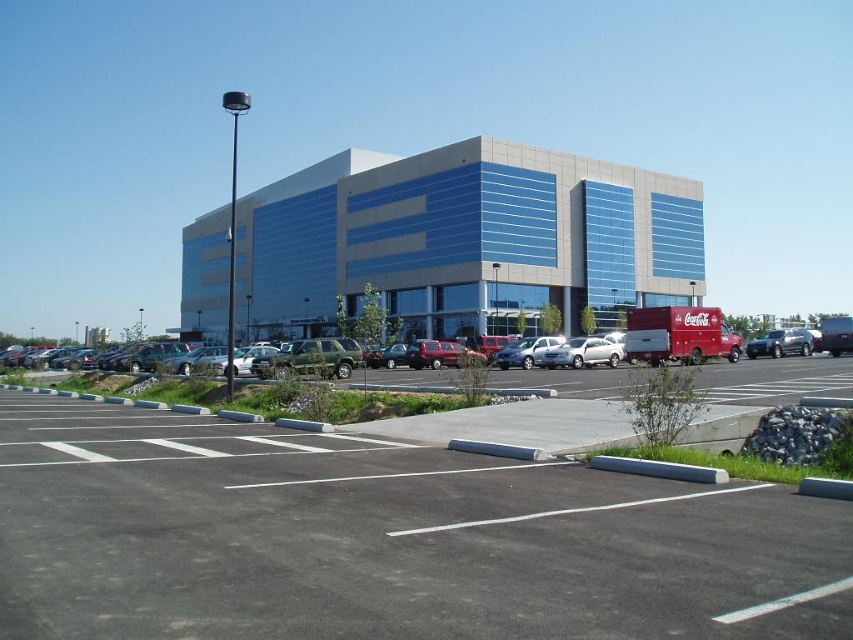
You are standing at the entrance of the commercial building and see two points marked on the parking lot. The first point is at coordinate point(567, 358) and the second is at point(757, 352). Which point is closer to you?

Point(567, 358) is in front of point(757, 352), so it is closer to you.